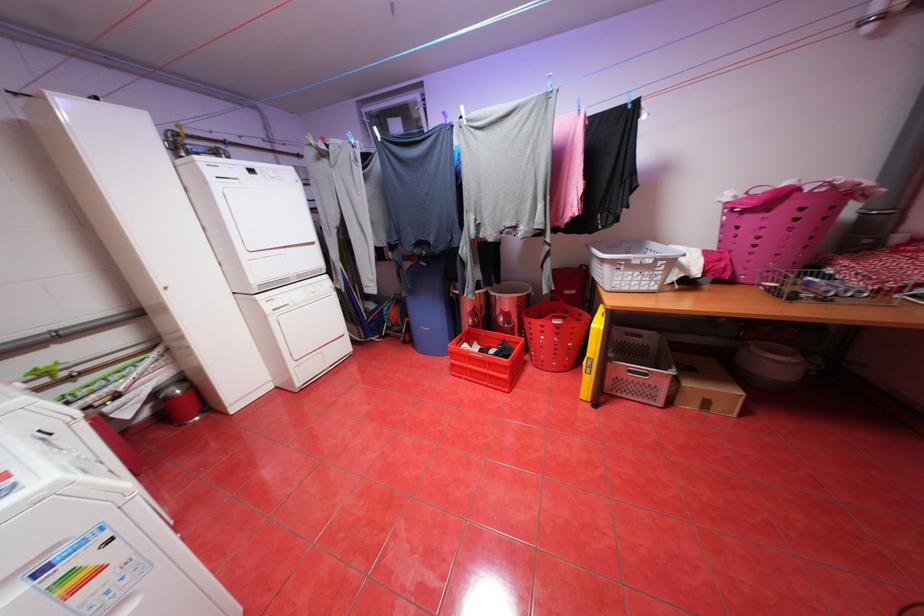
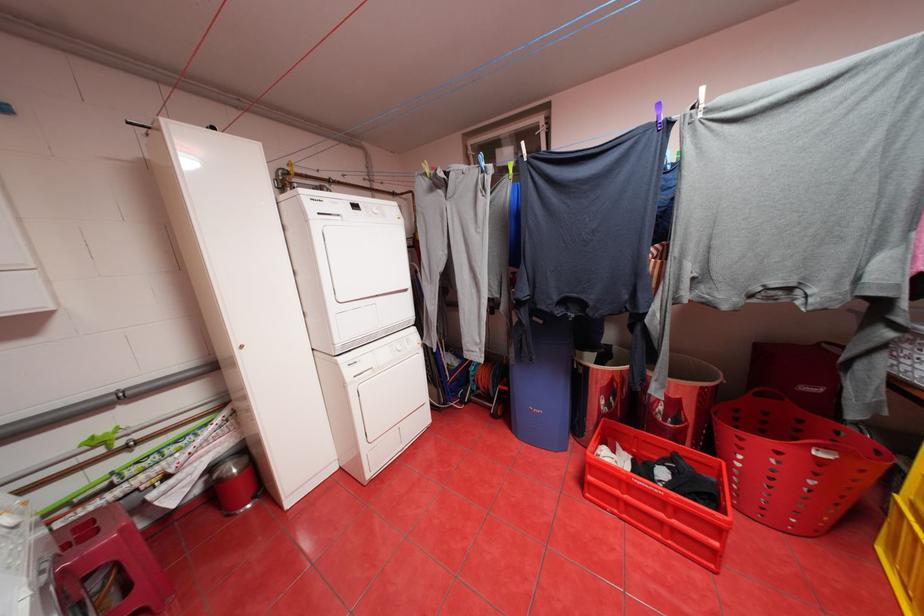
The point at (x=373, y=119) is marked in the first image. Where is the corresponding point in the second image?

(479, 152)